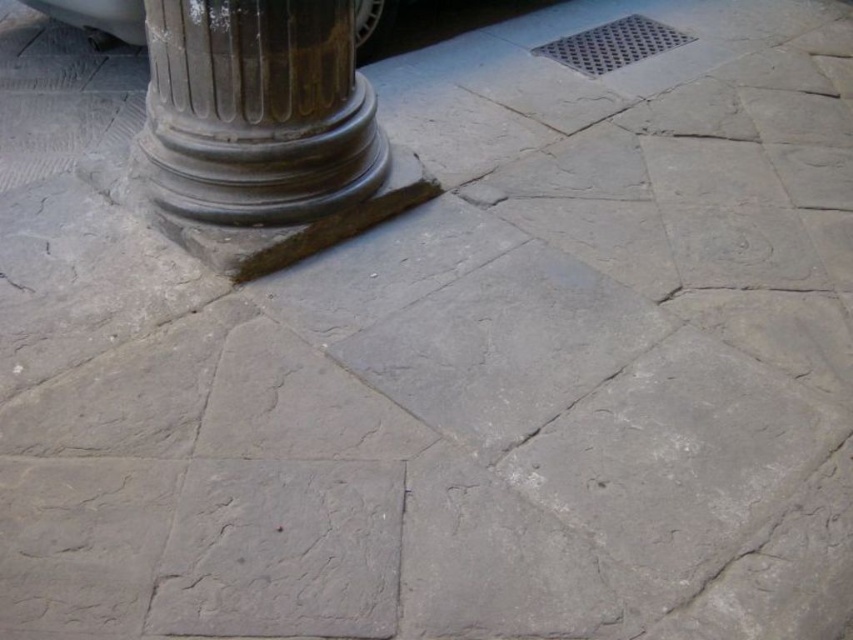
Is gray stone column at left wider than shiny silver car at upper left?

In fact, gray stone column at left might be narrower than shiny silver car at upper left.

Does gray stone column at left have a greater height compared to shiny silver car at upper left?

Correct, gray stone column at left is much taller as shiny silver car at upper left.

Who is more distant from viewer, (x=299, y=180) or (x=105, y=42)?

Positioned behind is point (x=105, y=42).

Where is `gray stone column at left`? The height and width of the screenshot is (640, 853). gray stone column at left is located at coordinates (257, 112).